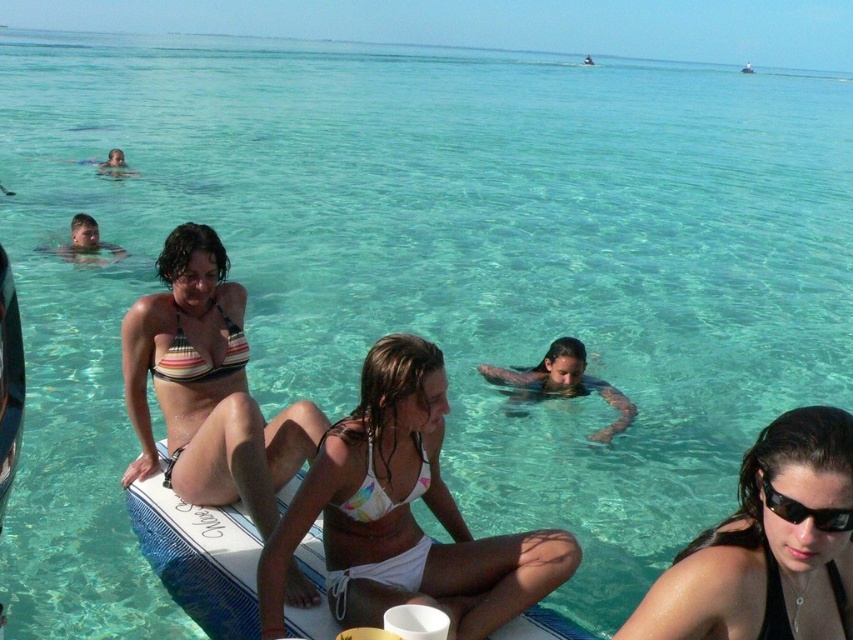
Is white bikini at center in front of striped fabric bikini at upper left?

Yes, it is.

Based on the photo, is white bikini at center above striped fabric bikini at upper left?

No.

Between point (347, 476) and point (242, 353), which one is positioned behind?

The point (242, 353) is behind.

At what (x,y) coordinates should I click in order to perform the action: click on white bikini at center. Please return your answer as a coordinate pair (x, y). Image resolution: width=853 pixels, height=640 pixels. Looking at the image, I should click on (403, 515).

Does point (434, 492) come closer to viewer compared to point (793, 474)?

That is False.

Can you confirm if white bikini at center is wider than black matte swimsuit at lower right?

Yes, white bikini at center is wider than black matte swimsuit at lower right.

Image resolution: width=853 pixels, height=640 pixels. What do you see at coordinates (403, 515) in the screenshot? I see `white bikini at center` at bounding box center [403, 515].

At what (x,y) coordinates should I click in order to perform the action: click on white bikini at center. Please return your answer as a coordinate pair (x, y). Looking at the image, I should click on (403, 515).

The image size is (853, 640). What are the coordinates of `striped bikini top at center` in the screenshot? It's located at (207, 387).